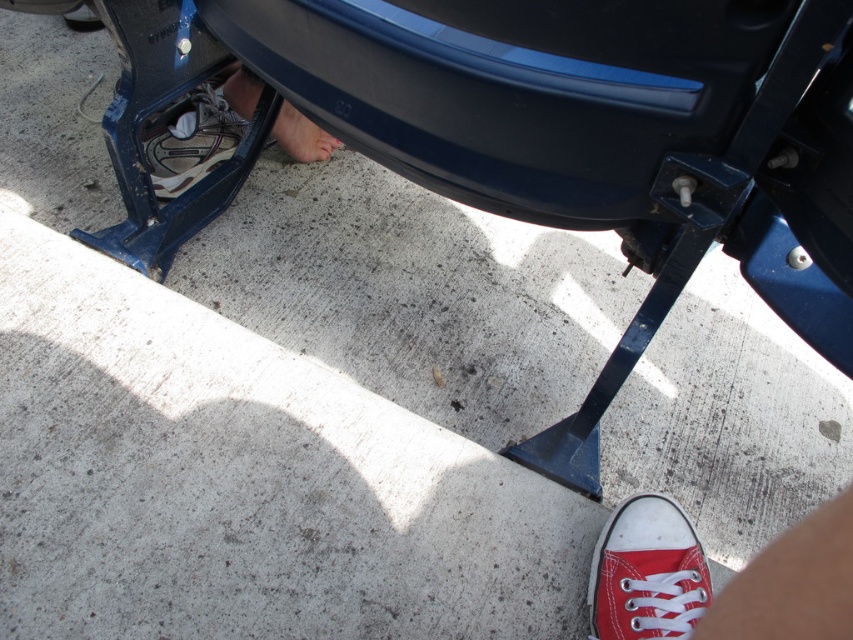
From the picture: You are standing near a vehicle and want to take a photo of the rear bumper. The camera you are holding is 32.49 inches away from the point marked as point (633,616). Can you confirm if this distance is sufficient to capture the entire bumper in the photo?

The camera is 32.49 inches away from point (633,616), which is the distance required to capture the entire bumper in the photo.